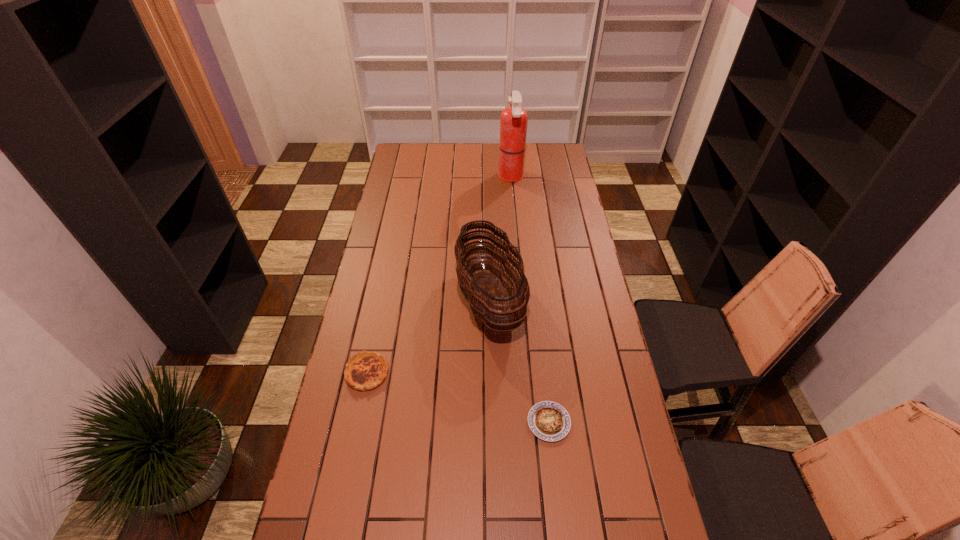
You are a GUI agent. You are given a task and a screenshot of the screen. Output one action in this format:
    pyautogui.click(x=<x>, y=<y>)
    Task: Click on the free region at the far right corner of the desktop
    
    Given the screenshot: What is the action you would take?
    pyautogui.click(x=548, y=160)

This screenshot has width=960, height=540. I want to click on empty location between the nearer quiche and the basket, so click(x=519, y=361).

At what (x,y) coordinates should I click in order to perform the action: click on free space between the shorter quiche and the farthest object. Please return your answer as a coordinate pair (x, y). The width and height of the screenshot is (960, 540). Looking at the image, I should click on (530, 299).

Locate which object is the third closest to the basket. Please provide its 2D coordinates. Your answer should be formatted as a tuple, i.e. [(x, y)], where the tuple contains the x and y coordinates of a point satisfying the conditions above.

[(513, 122)]

This screenshot has height=540, width=960. I want to click on object that is the closest one to the left quiche, so click(x=485, y=293).

The height and width of the screenshot is (540, 960). I want to click on free spot that satisfies the following two spatial constraints: 1. with the handle and hose on the tallest object; 2. on the right side of the shortest object, so click(533, 422).

Locate an element on the screen. vacant space that satisfies the following two spatial constraints: 1. on the back side of the basket; 2. on the left side of the taller quiche is located at coordinates (382, 300).

At what (x,y) coordinates should I click in order to perform the action: click on vacant region that satisfies the following two spatial constraints: 1. with the handle and hose on the farthest object; 2. on the front side of the third tallest object. Please return your answer as a coordinate pair (x, y). The height and width of the screenshot is (540, 960). Looking at the image, I should click on (528, 373).

In order to click on free spot that satisfies the following two spatial constraints: 1. with the handle and hose on the nearer quiche; 2. on the left side of the farthest object in this screenshot , I will do `click(533, 422)`.

The image size is (960, 540). I want to click on vacant region that satisfies the following two spatial constraints: 1. on the front side of the basket; 2. on the right side of the nearer quiche, so click(492, 422).